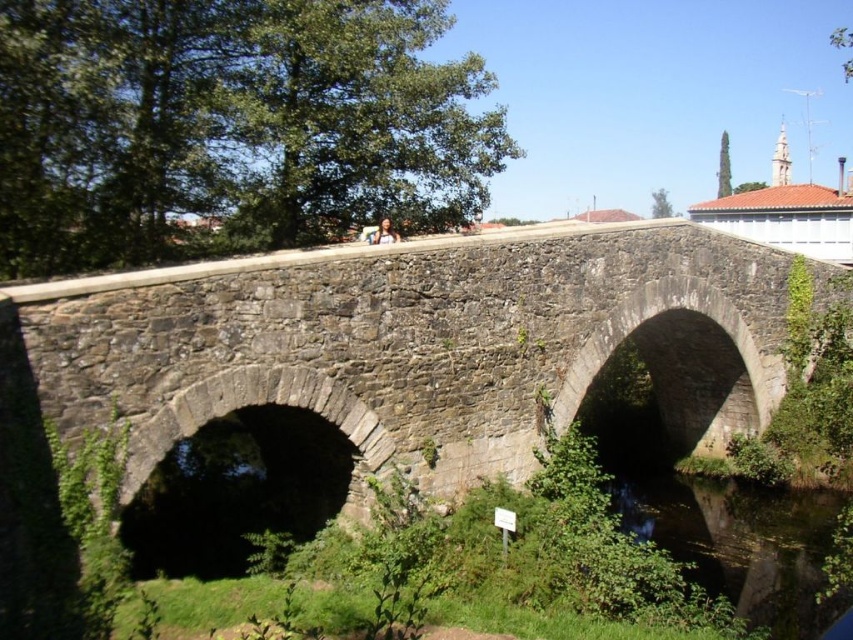
You are a tourist standing on the gray stone bridge at center. You want to take a photo of the clear water at bridge bottom. Which direction should you look to capture the water in your photo?

You should look downward because the gray stone bridge at center is above the clear water at bridge bottom, so the water is located beneath the bridge.

You are a boat captain trying to navigate a 30 feet long boat under the gray stone bridge at center. The clear water at bridge bottom is the path you need to pass through. Can your boat pass under the bridge without touching the structure? Please explain your reasoning.

The gray stone bridge at center and clear water at bridge bottom are 36.99 feet apart from each other. Since the vertical distance between the boat and the bridge is 36.99 feet, and the boat has a height of 30 feet, there should be enough clearance for the boat to pass safely under the bridge.